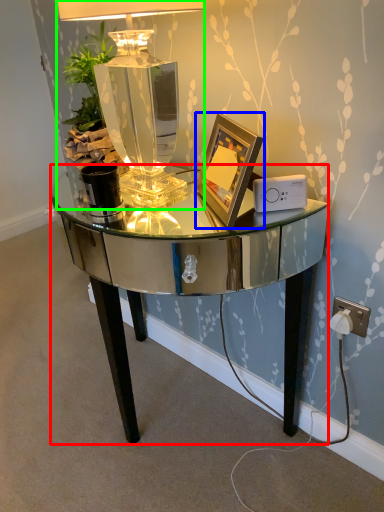
Question: Which object is positioned closest to desk (highlighted by a red box)? Select from picture frame (highlighted by a blue box) and lamp (highlighted by a green box).

Choices:
 (A) picture frame
 (B) lamp

Answer: (A)